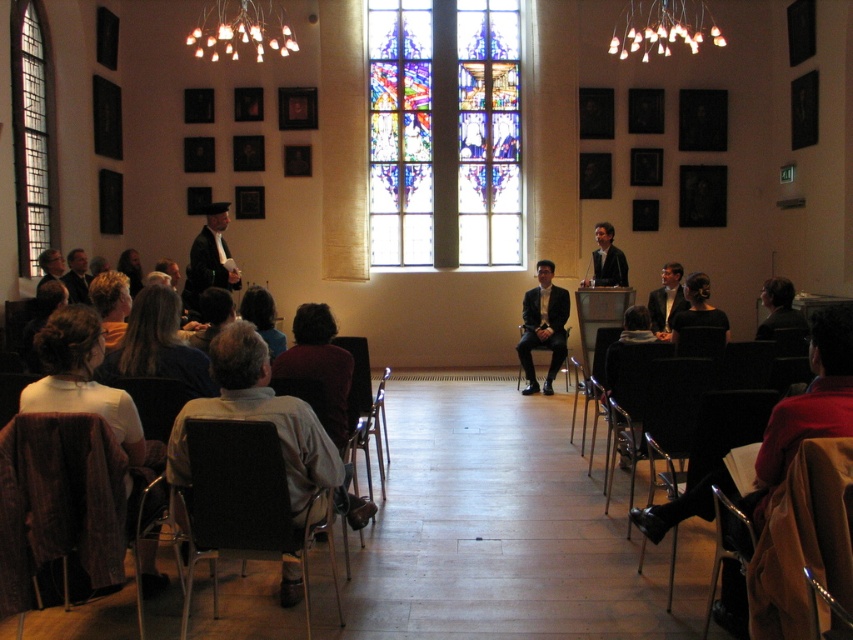
Question: From the image, what is the correct spatial relationship of velvet brown chair at lower left in relation to dark brown hair at lower left?

Choices:
 (A) left
 (B) right

Answer: (B)

Question: Which point appears farthest from the camera in this image?

Choices:
 (A) (753, 600)
 (B) (57, 556)
 (C) (289, 545)
 (D) (691, 308)

Answer: (D)

Question: Is metallic silver chair at lower left positioned behind light brown leather jacket at lower left?

Choices:
 (A) yes
 (B) no

Answer: (B)

Question: Which object is farther from the camera taking this photo?

Choices:
 (A) metallic silver chair at lower left
 (B) dark brown hair at center
 (C) dark gray suit at left

Answer: (C)

Question: Which object is positioned closest to the dark brown hair at lower left?

Choices:
 (A) blonde hair at lower left
 (B) stained glass window at center
 (C) metallic silver chair at center
 (D) black fabric dress at center

Answer: (A)

Question: Is white fabric at lower left smaller than formal black suit at center?

Choices:
 (A) no
 (B) yes

Answer: (B)